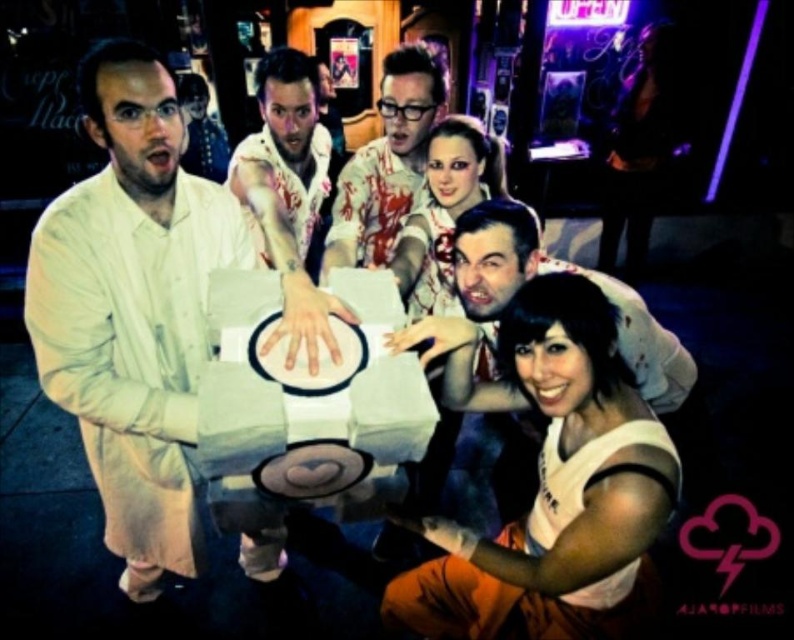
Who is more distant from viewer, (153,573) or (372,145)?

Point (372,145)

Between light beige lab coat at left and blood-stained shirt at center, which one has more height?

Standing taller between the two is light beige lab coat at left.

This screenshot has width=794, height=640. Identify the location of light beige lab coat at left. (133, 308).

The height and width of the screenshot is (640, 794). Identify the location of light beige lab coat at left. (133, 308).

How far apart are matte white shirt at lower right and blood-stained white shirt at center?

matte white shirt at lower right is 38.66 inches from blood-stained white shirt at center.

Which is more to the right, matte white shirt at lower right or blood-stained white shirt at center?

matte white shirt at lower right

Measure the distance between point (604, 472) and camera.

Point (604, 472) and camera are 1.23 meters apart from each other.

Find the location of `matte white shirt at lower right`. matte white shirt at lower right is located at coordinates (557, 493).

Is blood-stained shirt at center above blood-stained white shirt at center?

Yes, blood-stained shirt at center is above blood-stained white shirt at center.

Between point (361, 173) and point (278, 173), which one is positioned behind?

Point (278, 173)

This screenshot has width=794, height=640. What do you see at coordinates (387, 163) in the screenshot?
I see `blood-stained shirt at center` at bounding box center [387, 163].

I want to click on blood-stained shirt at center, so click(387, 163).